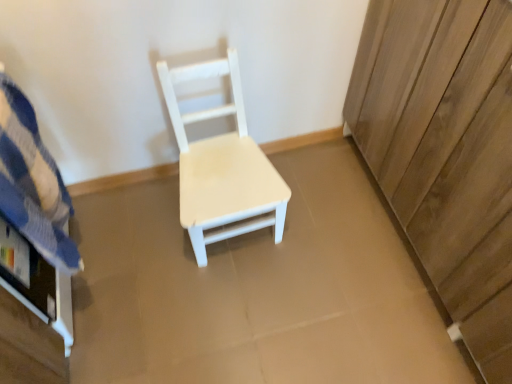
Question: Is wooden dresser at right wider than blue striped fabric at left?

Choices:
 (A) no
 (B) yes

Answer: (B)

Question: Does wooden dresser at right touch blue striped fabric at left?

Choices:
 (A) no
 (B) yes

Answer: (A)

Question: Is wooden dresser at right at the left side of blue striped fabric at left?

Choices:
 (A) no
 (B) yes

Answer: (A)

Question: Considering the relative sizes of wooden dresser at right and blue striped fabric at left in the image provided, is wooden dresser at right bigger than blue striped fabric at left?

Choices:
 (A) no
 (B) yes

Answer: (B)

Question: Is wooden dresser at right oriented towards blue striped fabric at left?

Choices:
 (A) no
 (B) yes

Answer: (B)

Question: From the image's perspective, relative to white matte wood chair at center, is wooden dresser at right above or below?

Choices:
 (A) below
 (B) above

Answer: (B)

Question: From a real-world perspective, is wooden dresser at right above or below white matte wood chair at center?

Choices:
 (A) above
 (B) below

Answer: (A)

Question: Does point coord(392,122) appear closer or farther from the camera than point coord(229,193)?

Choices:
 (A) farther
 (B) closer

Answer: (A)

Question: Is wooden dresser at right wider or thinner than white matte wood chair at center?

Choices:
 (A) thin
 (B) wide

Answer: (B)

Question: In terms of width, does blue striped fabric at left look wider or thinner when compared to white matte wood chair at center?

Choices:
 (A) wide
 (B) thin

Answer: (B)

Question: From a real-world perspective, is blue striped fabric at left above or below white matte wood chair at center?

Choices:
 (A) below
 (B) above

Answer: (B)

Question: Relative to white matte wood chair at center, is blue striped fabric at left in front or behind?

Choices:
 (A) behind
 (B) front

Answer: (B)

Question: Considering the positions of blue striped fabric at left and white matte wood chair at center in the image, is blue striped fabric at left bigger or smaller than white matte wood chair at center?

Choices:
 (A) big
 (B) small

Answer: (B)

Question: Considering the positions of white matte wood chair at center and wooden dresser at right in the image, is white matte wood chair at center taller or shorter than wooden dresser at right?

Choices:
 (A) short
 (B) tall

Answer: (A)

Question: From the image's perspective, is white matte wood chair at center located above or below wooden dresser at right?

Choices:
 (A) below
 (B) above

Answer: (A)